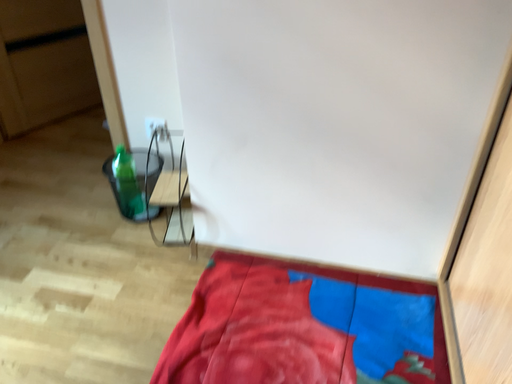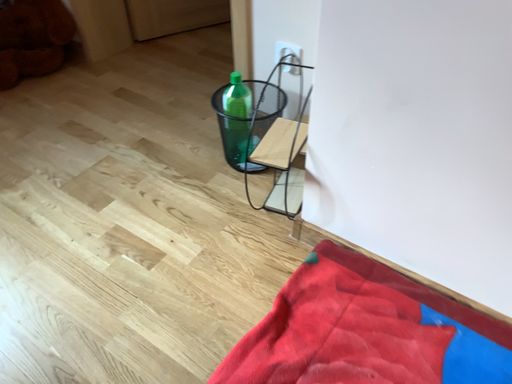
Question: Which way did the camera rotate in the video?

Choices:
 (A) rotated left
 (B) rotated right

Answer: (A)